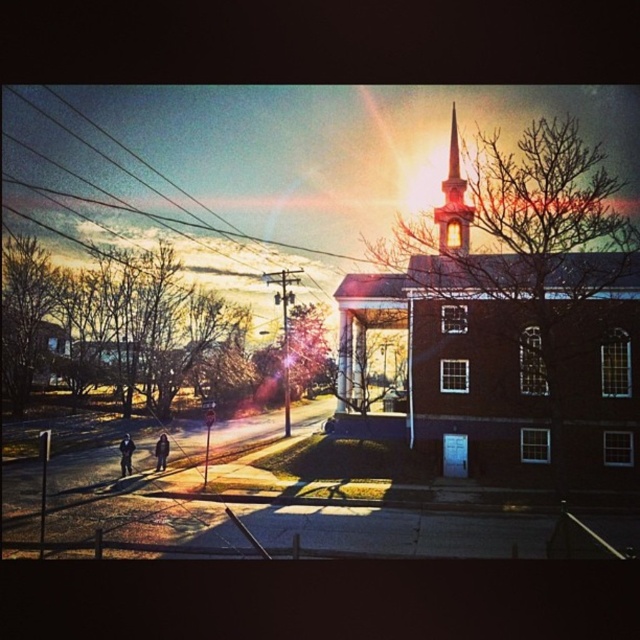
Consider the image. Between metallic wires at upper left and smooth brick steeple at upper center, which one is positioned higher?

metallic wires at upper left is higher up.

Can you confirm if metallic wires at upper left is taller than smooth brick steeple at upper center?

Yes.

The width and height of the screenshot is (640, 640). Identify the location of metallic wires at upper left. point(148,184).

Can you confirm if brick church at center is smaller than smooth brick steeple at upper center?

Incorrect, brick church at center is not smaller in size than smooth brick steeple at upper center.

Is point (486, 344) closer to viewer compared to point (460, 227)?

Yes, it is.

Identify the location of brick church at center. (513, 332).

The image size is (640, 640). What do you see at coordinates (513, 332) in the screenshot? I see `brick church at center` at bounding box center [513, 332].

This screenshot has height=640, width=640. Identify the location of brick church at center. (513, 332).